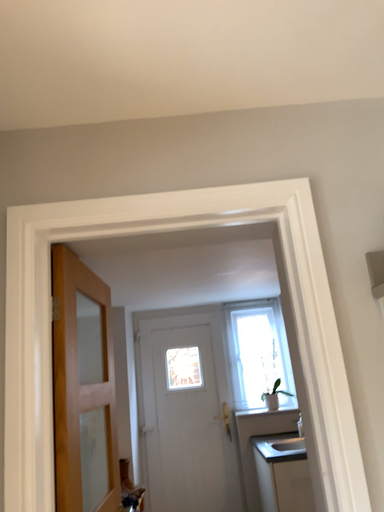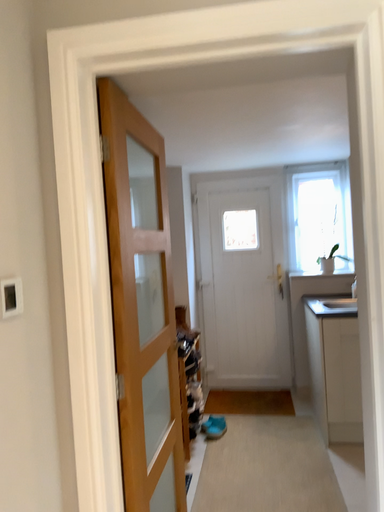
Question: Which way did the camera rotate in the video?

Choices:
 (A) rotated downward
 (B) rotated upward

Answer: (A)